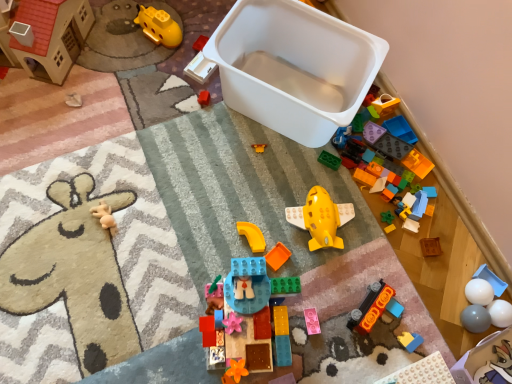
You are a GUI agent. You are given a task and a screenshot of the screen. Output one action in this format:
    pyautogui.click(x=<x>, y=<y>)
    Task: Click on the free spot to the right of orange matte block at center, acting as the 6th toy starting from the left
    This screenshot has width=512, height=384.
    Given the screenshot: What is the action you would take?
    pyautogui.click(x=334, y=276)